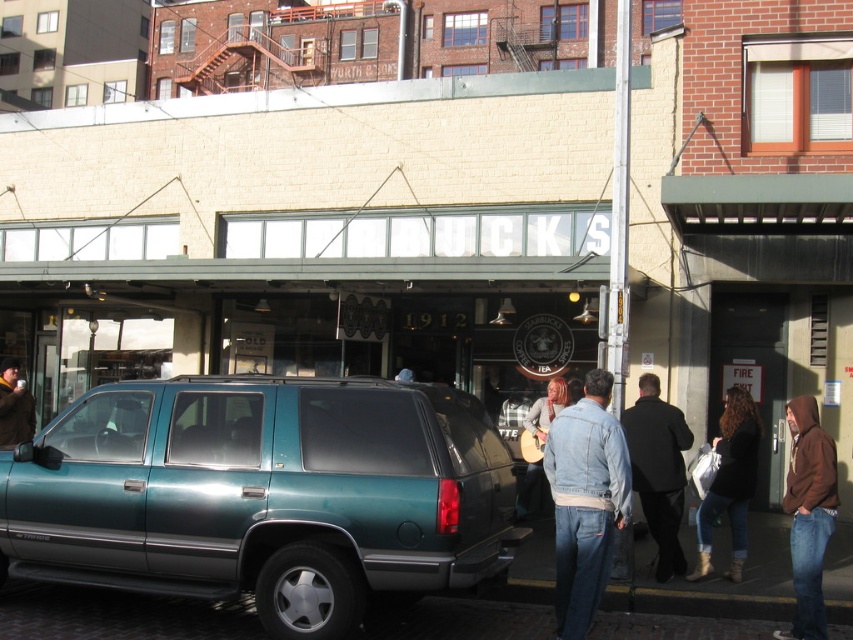
Question: Does teal metallic minivan at center have a greater width compared to denim jacket at lower right?

Choices:
 (A) yes
 (B) no

Answer: (A)

Question: Which object is positioned farthest from the brown leather jacket at lower right?

Choices:
 (A) brown leather jacket at left
 (B) silver metallic tire at lower left
 (C) teal metallic minivan at center

Answer: (A)

Question: Can you confirm if dark brown leather jacket at lower right is smaller than brown leather jacket at left?

Choices:
 (A) yes
 (B) no

Answer: (B)

Question: Is teal metallic minivan at center to the left of denim jacket at lower right from the viewer's perspective?

Choices:
 (A) no
 (B) yes

Answer: (B)

Question: Which is nearer to the teal metallic minivan at center?

Choices:
 (A) dark brown leather jacket at lower right
 (B) brown leather jacket at left
 (C) brown leather jacket at lower right

Answer: (A)

Question: Based on their relative distances, which object is farther from the dark brown leather jacket at lower right?

Choices:
 (A) brown leather jacket at left
 (B) teal metallic minivan at center
 (C) brown leather jacket at lower right
 (D) denim jacket at lower right

Answer: (A)